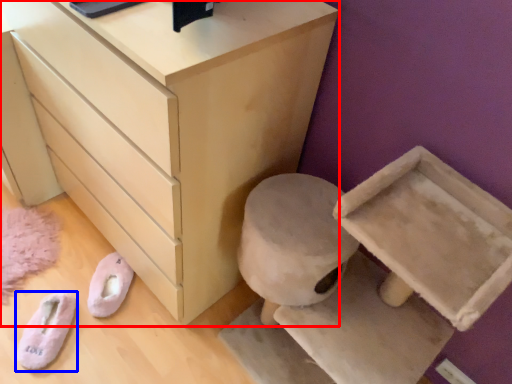
Question: Among these objects, which one is farthest to the camera, chest of drawers (highlighted by a red box) or footwear (highlighted by a blue box)?

Choices:
 (A) chest of drawers
 (B) footwear

Answer: (B)